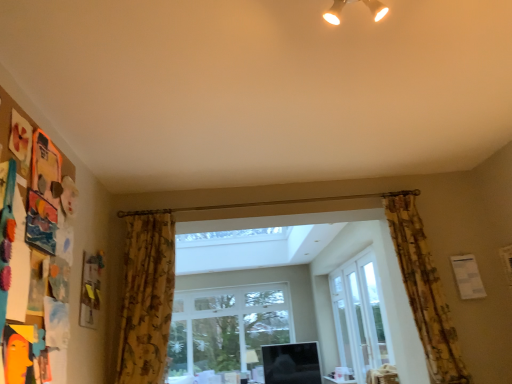
Describe the element at coordinates (359, 316) in the screenshot. This screenshot has height=384, width=512. I see `white glass door at center, the first window viewed from the right` at that location.

This screenshot has width=512, height=384. In order to click on clear glass window at center, the first window from the left in this screenshot , I will do `click(226, 332)`.

What do you see at coordinates (424, 290) in the screenshot? This screenshot has width=512, height=384. I see `floral fabric curtain at right, the 2th curtain from the left` at bounding box center [424, 290].

Describe the element at coordinates (146, 296) in the screenshot. This screenshot has width=512, height=384. I see `floral fabric curtain at left, marked as the second curtain in a right-to-left arrangement` at that location.

What is the approximate height of white glass screen door at center?

white glass screen door at center is 4.52 feet in height.

Locate an element on the screen. The width and height of the screenshot is (512, 384). white glass door at center, acting as the 2th window starting from the left is located at coordinates (359, 316).

Is floral fabric curtain at right, marked as the 1th curtain in a right-to-left arrangement, with white glass screen door at center?

No, floral fabric curtain at right, marked as the 1th curtain in a right-to-left arrangement, is not touching white glass screen door at center.

Considering the sizes of objects floral fabric curtain at right, the 2th curtain from the left, and white glass screen door at center in the image provided, who is taller, floral fabric curtain at right, the 2th curtain from the left, or white glass screen door at center?

With more height is white glass screen door at center.

From a real-world perspective, is floral fabric curtain at right, the 2th curtain from the left, positioned above or below white glass screen door at center?

In terms of real-world spatial position, floral fabric curtain at right, the 2th curtain from the left, is above white glass screen door at center.

Which is behind, floral fabric curtain at right, the 2th curtain from the left, or white glass screen door at center?

white glass screen door at center is more distant.

Is there a large distance between white glass screen door at center and floral fabric curtain at left, marked as the second curtain in a right-to-left arrangement?

Yes, white glass screen door at center and floral fabric curtain at left, marked as the second curtain in a right-to-left arrangement, are quite far apart.

Is white glass screen door at center spatially inside floral fabric curtain at left, marked as the second curtain in a right-to-left arrangement, or outside of it?

white glass screen door at center cannot be found inside floral fabric curtain at left, marked as the second curtain in a right-to-left arrangement.

Can you confirm if white glass screen door at center is positioned to the left of floral fabric curtain at left, which ranks as the first curtain in left-to-right order?

No, white glass screen door at center is not to the left of floral fabric curtain at left, which ranks as the first curtain in left-to-right order.

In terms of width, does white glass screen door at center look wider or thinner when compared to floral fabric curtain at left, which ranks as the first curtain in left-to-right order?

Clearly, white glass screen door at center has less width compared to floral fabric curtain at left, which ranks as the first curtain in left-to-right order.

Which of these two, white glass door at center, the first window viewed from the right, or white glossy spotlights at upper center, stands shorter?

white glossy spotlights at upper center is shorter.

Between point (340, 331) and point (384, 13), which one is positioned in front?

The point (384, 13) is in front.

Where is `window that is on the right side of white glossy spotlights at upper center`? window that is on the right side of white glossy spotlights at upper center is located at coordinates (359, 316).

Which is behind, white glass door at center, arranged as the first window when viewed from the front, or white glossy spotlights at upper center?

white glass door at center, arranged as the first window when viewed from the front, is further from the camera.

Is point (184, 328) less distant than point (331, 279)?

No, (184, 328) is behind (331, 279).

Measure the distance between clear glass window at center, arranged as the 2th window when viewed from the right, and white glass screen door at center.

clear glass window at center, arranged as the 2th window when viewed from the right, is 5.01 feet away from white glass screen door at center.

From a real-world perspective, is clear glass window at center, placed as the first window when sorted from back to front, on top of white glass screen door at center?

Incorrect, from a real-world perspective, clear glass window at center, placed as the first window when sorted from back to front, is lower than white glass screen door at center.

Which object is positioned more to the right, clear glass window at center, the second window in the front-to-back sequence, or white glass screen door at center?

Positioned to the right is white glass screen door at center.

Does point (227, 370) appear closer or farther from the camera than point (421, 271)?

Point (227, 370) is farther from the camera than point (421, 271).

How many degrees apart are the facing directions of clear glass window at center, arranged as the 2th window when viewed from the right, and floral fabric curtain at right, marked as the 1th curtain in a right-to-left arrangement?

0.245 degrees separate the facing orientations of clear glass window at center, arranged as the 2th window when viewed from the right, and floral fabric curtain at right, marked as the 1th curtain in a right-to-left arrangement.

Is clear glass window at center, arranged as the 2th window when viewed from the right, facing towards floral fabric curtain at right, marked as the 1th curtain in a right-to-left arrangement?

Yes, clear glass window at center, arranged as the 2th window when viewed from the right, is facing floral fabric curtain at right, marked as the 1th curtain in a right-to-left arrangement.

Consider the image. Looking at the image, does clear glass window at center, the second window in the front-to-back sequence, seem bigger or smaller compared to floral fabric curtain at right, the 2th curtain from the left?

Clearly, clear glass window at center, the second window in the front-to-back sequence, is larger in size than floral fabric curtain at right, the 2th curtain from the left.

Considering the points (358, 264) and (156, 357), which point is behind, point (358, 264) or point (156, 357)?

Positioned behind is point (358, 264).

Does white glass door at center, the first window viewed from the right, come behind floral fabric curtain at left, which ranks as the first curtain in left-to-right order?

Yes, white glass door at center, the first window viewed from the right, is behind floral fabric curtain at left, which ranks as the first curtain in left-to-right order.

Can you confirm if white glass door at center, the first window viewed from the right, is shorter than floral fabric curtain at left, which ranks as the first curtain in left-to-right order?

Incorrect, the height of white glass door at center, the first window viewed from the right, does not fall short of that of floral fabric curtain at left, which ranks as the first curtain in left-to-right order.

What's the angular difference between floral fabric curtain at left, which ranks as the first curtain in left-to-right order, and clear glass window at center, placed as the first window when sorted from back to front,'s facing directions?

They differ by 0.416 degrees in their facing directions.

Is floral fabric curtain at left, marked as the second curtain in a right-to-left arrangement, facing away from clear glass window at center, arranged as the 2th window when viewed from the right?

Correct, floral fabric curtain at left, marked as the second curtain in a right-to-left arrangement, is looking away from clear glass window at center, arranged as the 2th window when viewed from the right.

From the image's perspective, which object appears higher, floral fabric curtain at left, marked as the second curtain in a right-to-left arrangement, or clear glass window at center, placed as the first window when sorted from back to front?

floral fabric curtain at left, marked as the second curtain in a right-to-left arrangement.

Which of these two, floral fabric curtain at left, which ranks as the first curtain in left-to-right order, or clear glass window at center, the first window from the left, is smaller?

A: floral fabric curtain at left, which ranks as the first curtain in left-to-right order, is smaller.

This screenshot has height=384, width=512. Find the location of `screen door on the right side of floral fabric curtain at right, marked as the 1th curtain in a right-to-left arrangement`. screen door on the right side of floral fabric curtain at right, marked as the 1th curtain in a right-to-left arrangement is located at coordinates (342, 324).

I want to click on curtain that is the 1st object located above the white glass screen door at center (from the image's perspective), so click(146, 296).

In the scene shown: Considering their positions, is floral fabric curtain at right, marked as the 1th curtain in a right-to-left arrangement, positioned further to white glass door at center, arranged as the first window when viewed from the front, than white glossy spotlights at upper center?

The object further to white glass door at center, arranged as the first window when viewed from the front, is white glossy spotlights at upper center.

Looking at the image, which one is located further to white glossy spotlights at upper center, clear glass window at center, the first window from the left, or white glass door at center, the 2th window when ordered from back to front?

Among the two, clear glass window at center, the first window from the left, is located further to white glossy spotlights at upper center.

Considering their positions, is white glossy spotlights at upper center positioned further to floral fabric curtain at left, which ranks as the first curtain in left-to-right order, than floral fabric curtain at right, marked as the 1th curtain in a right-to-left arrangement?

white glossy spotlights at upper center.

Considering their positions, is white glass screen door at center positioned closer to floral fabric curtain at left, which ranks as the first curtain in left-to-right order, than white glass door at center, the first window viewed from the right?

The object closer to floral fabric curtain at left, which ranks as the first curtain in left-to-right order, is white glass door at center, the first window viewed from the right.

Looking at the image, which one is located further to white glass screen door at center, clear glass window at center, the first window from the left, or floral fabric curtain at right, marked as the 1th curtain in a right-to-left arrangement?

Among the two, floral fabric curtain at right, marked as the 1th curtain in a right-to-left arrangement, is located further to white glass screen door at center.

When comparing their distances from white glass screen door at center, does floral fabric curtain at right, marked as the 1th curtain in a right-to-left arrangement, or white glossy spotlights at upper center seem closer?

floral fabric curtain at right, marked as the 1th curtain in a right-to-left arrangement.

From the image, which object appears to be farther from white glass door at center, the 2th window when ordered from back to front, white glass screen door at center or floral fabric curtain at right, the 2th curtain from the left?

floral fabric curtain at right, the 2th curtain from the left, lies further to white glass door at center, the 2th window when ordered from back to front, than the other object.

When comparing their distances from white glass screen door at center, does white glossy spotlights at upper center or floral fabric curtain at right, marked as the 1th curtain in a right-to-left arrangement, seem closer?

floral fabric curtain at right, marked as the 1th curtain in a right-to-left arrangement.

In order to click on screen door between floral fabric curtain at left, marked as the second curtain in a right-to-left arrangement, and clear glass window at center, the first window from the left, along the z-axis in this screenshot , I will do `click(342, 324)`.

I want to click on curtain between floral fabric curtain at left, marked as the second curtain in a right-to-left arrangement, and white glass screen door at center, along the z-axis, so click(424, 290).

You are a GUI agent. You are given a task and a screenshot of the screen. Output one action in this format:
    pyautogui.click(x=<x>, y=<y>)
    Task: Click on the screen door positioned between white glossy spotlights at upper center and clear glass window at center, the first window from the left, from near to far
    This screenshot has height=384, width=512.
    Given the screenshot: What is the action you would take?
    pyautogui.click(x=342, y=324)

Where is `window between floral fabric curtain at left, marked as the second curtain in a right-to-left arrangement, and clear glass window at center, arranged as the 2th window when viewed from the right, along the z-axis`? window between floral fabric curtain at left, marked as the second curtain in a right-to-left arrangement, and clear glass window at center, arranged as the 2th window when viewed from the right, along the z-axis is located at coordinates (359, 316).